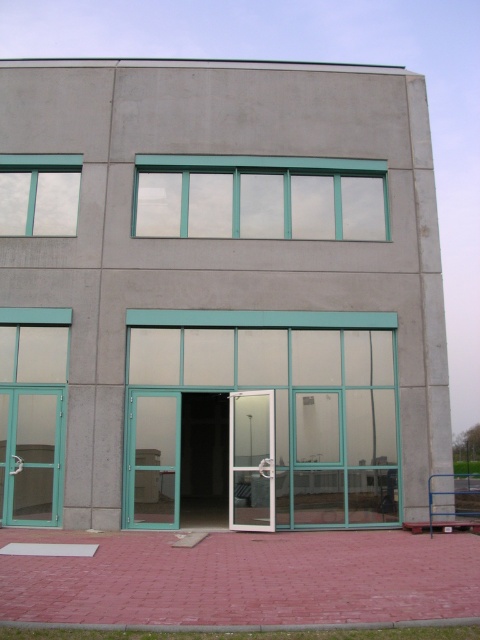
Question: Can you confirm if clear glass window at upper center is positioned above transparent glass door at center?

Choices:
 (A) no
 (B) yes

Answer: (B)

Question: Based on their relative distances, which object is farther from the transparent glass door at center?

Choices:
 (A) matte glass window at upper left
 (B) clear glass window at upper center

Answer: (A)

Question: Which object is the farthest from the matte glass window at upper left?

Choices:
 (A) transparent glass door at center
 (B) clear glass window at upper center

Answer: (A)

Question: Which of these objects is positioned farthest from the transparent glass door at center?

Choices:
 (A) clear glass window at upper center
 (B) matte glass window at upper left

Answer: (B)

Question: Is clear glass window at upper center thinner than transparent glass door at center?

Choices:
 (A) yes
 (B) no

Answer: (B)

Question: Does matte glass window at upper left appear on the left side of transparent glass door at center?

Choices:
 (A) yes
 (B) no

Answer: (A)